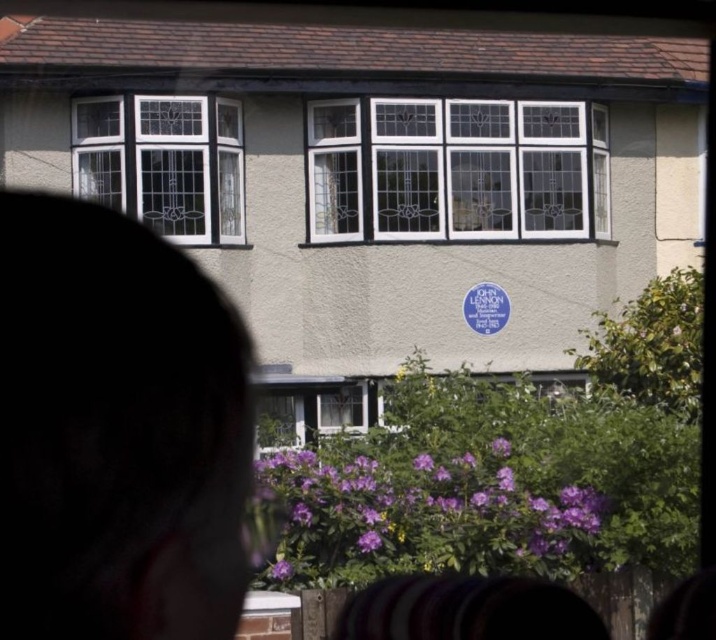
You are an architect analyzing the facade of this building. You notice the silhouette hair at center and the white glass window at left. Which of these two elements has a larger visual impact based on their size?

The white glass window at left has a larger visual impact because it is bigger than the silhouette hair at center.

What is the spatial relationship between the silhouette hair at center and the white glass window at left in the image?

The silhouette hair at center is positioned on the right side of the white glass window at left.